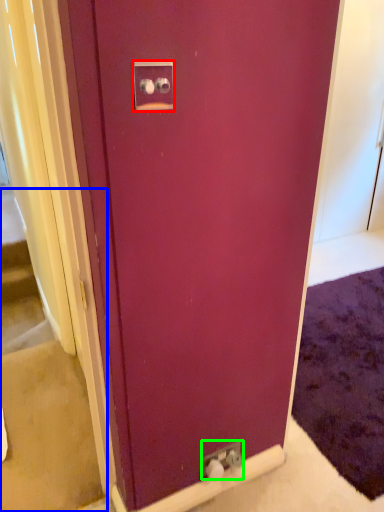
Question: Estimate the real-world distances between objects in this image. Which object is farther from electric outlet (highlighted by a red box), stairwell (highlighted by a blue box) or electric outlet (highlighted by a green box)?

Choices:
 (A) stairwell
 (B) electric outlet

Answer: (A)